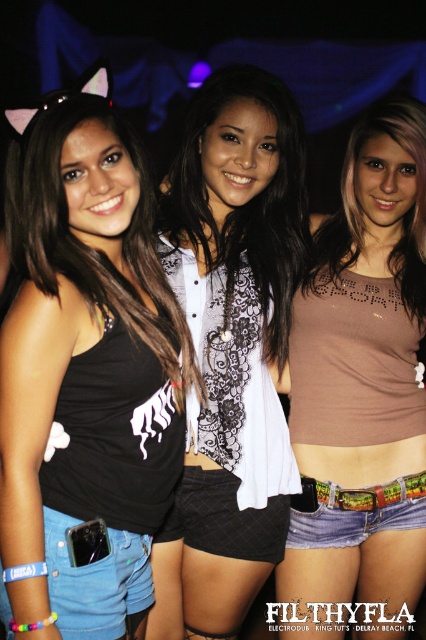
Looking at this image, you are a photographer at the event and want to ensure both the black matte tank top at left and the multicolored printed fabric at lower center are visible in your photo. Which object should you focus on to capture both without cropping either?

You should focus on the black matte tank top at left because it is larger than the multicolored printed fabric at lower center, so centering on it would still allow the smaller fabric to be in frame.

Where is the black matte tank top at left located in the image?

The black matte tank top at left is located at point [86,333] in the image.